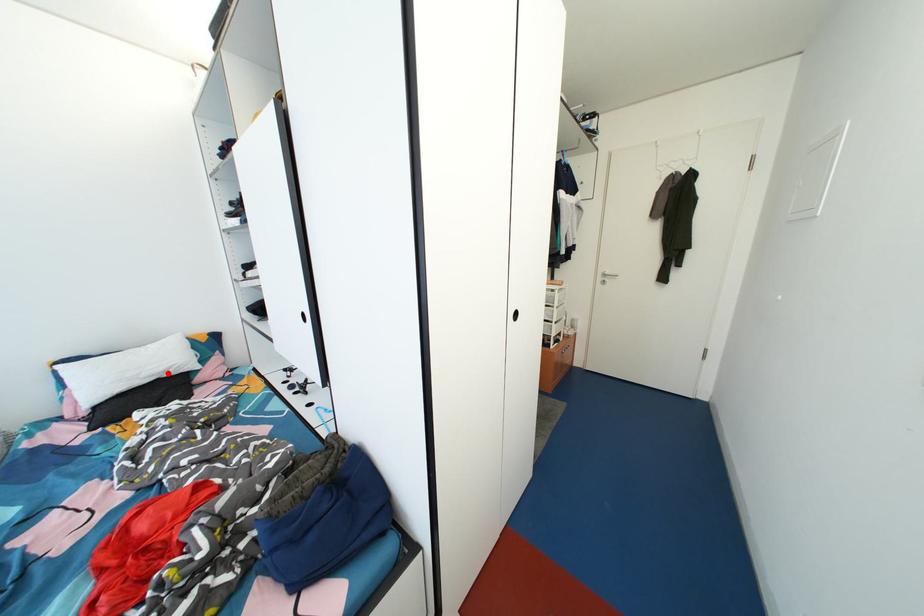
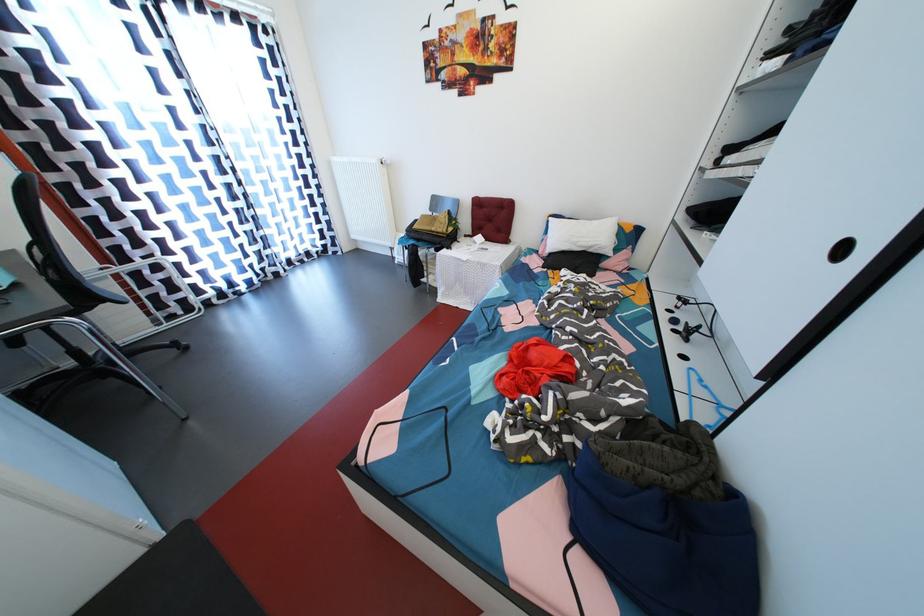
Where in the second image is the point corresponding to the highlighted location from the first image?

(597, 249)